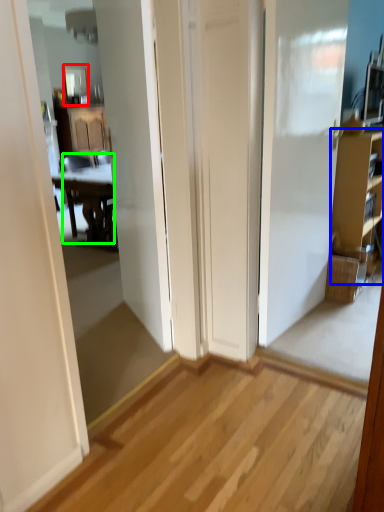
Question: Considering the real-world distances, which object is farthest from mirror (highlighted by a red box)? cabinetry (highlighted by a blue box) or chair (highlighted by a green box)?

Choices:
 (A) cabinetry
 (B) chair

Answer: (A)